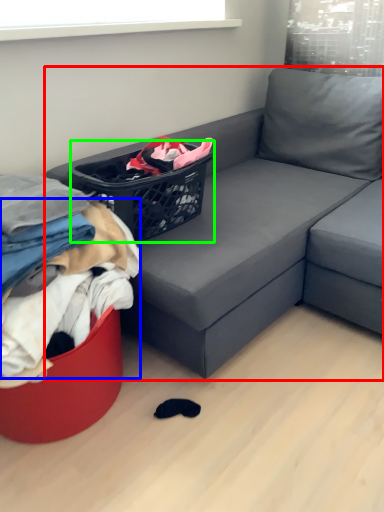
Question: Which is farther away from studio couch (highlighted by a red box)? clothing (highlighted by a blue box) or basket (highlighted by a green box)?

Choices:
 (A) clothing
 (B) basket

Answer: (A)